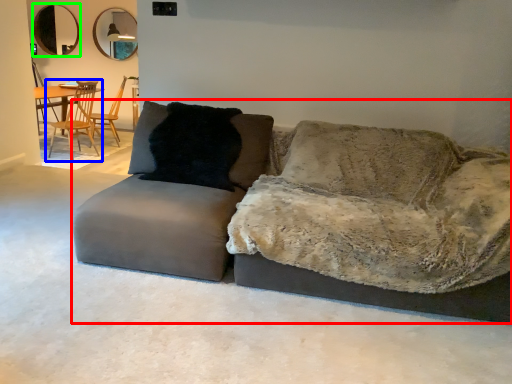
Question: Which object is positioned closest to studio couch (highlighted by a red box)? Select from chair (highlighted by a blue box) and mirror (highlighted by a green box).

Choices:
 (A) chair
 (B) mirror

Answer: (A)